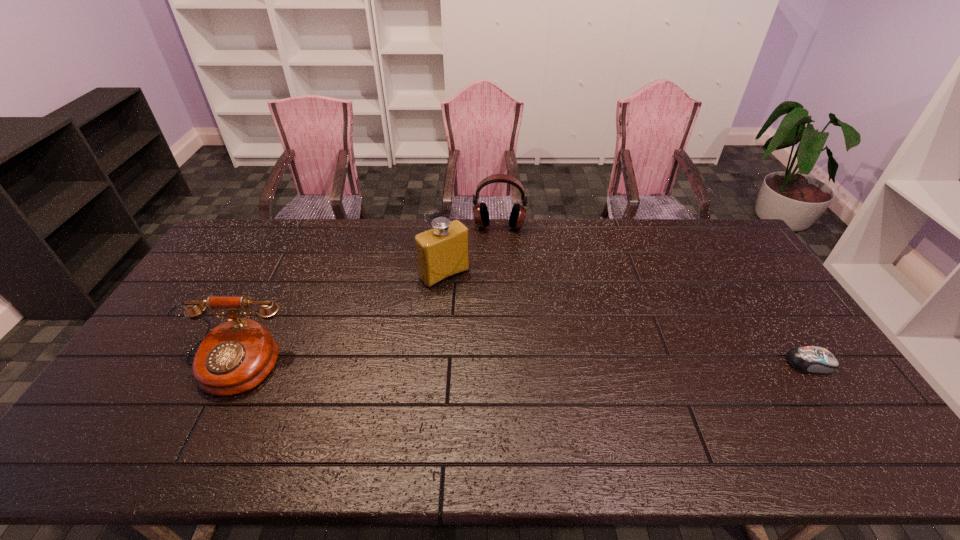
Identify the location of vacant region between the shortest object and the third nearest object. (627, 319).

Locate an element on the screen. vacant area between the telephone and the tallest object is located at coordinates (337, 320).

Find the location of `object identified as the third closest to the computer mouse`. object identified as the third closest to the computer mouse is located at coordinates (234, 357).

At what (x,y) coordinates should I click in order to perform the action: click on the closest object to the rightmost object. Please return your answer as a coordinate pair (x, y). Looking at the image, I should click on (480, 211).

Where is `free point that satisfies the following two spatial constraints: 1. on the front side of the headset; 2. on the wheel side of the rightmost object`? This screenshot has width=960, height=540. free point that satisfies the following two spatial constraints: 1. on the front side of the headset; 2. on the wheel side of the rightmost object is located at coordinates (507, 363).

At what (x,y) coordinates should I click in order to perform the action: click on free space that satisfies the following two spatial constraints: 1. on the front side of the rightmost object; 2. on the wheel side of the headset. Please return your answer as a coordinate pair (x, y). The width and height of the screenshot is (960, 540). Looking at the image, I should click on (507, 363).

Where is `free spot that satisfies the following two spatial constraints: 1. on the front side of the computer mouse; 2. on the wheel side of the farthest object`? free spot that satisfies the following two spatial constraints: 1. on the front side of the computer mouse; 2. on the wheel side of the farthest object is located at coordinates (507, 363).